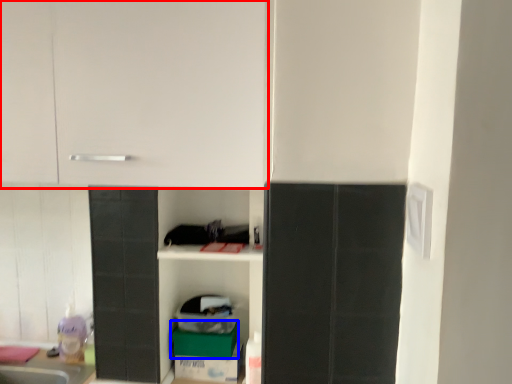
Question: Which object appears closest to the camera in this image, cabinetry (highlighted by a red box) or cardboard box (highlighted by a blue box)?

Choices:
 (A) cabinetry
 (B) cardboard box

Answer: (A)